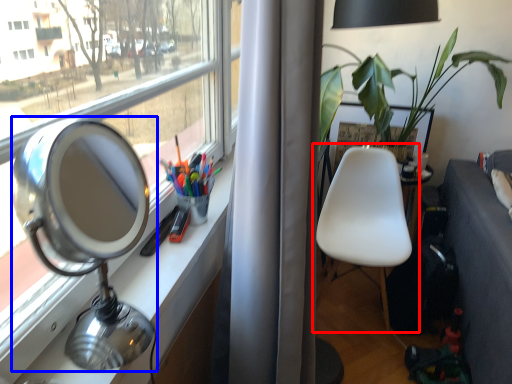
Question: Which of the following is the closest to the observer, chair (highlighted by a red box) or table lamp (highlighted by a blue box)?

Choices:
 (A) chair
 (B) table lamp

Answer: (B)